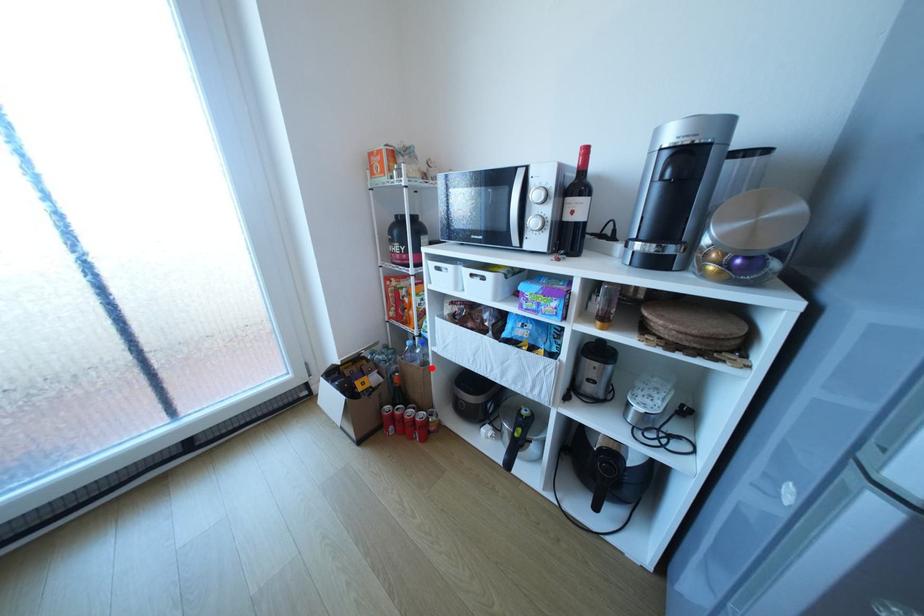
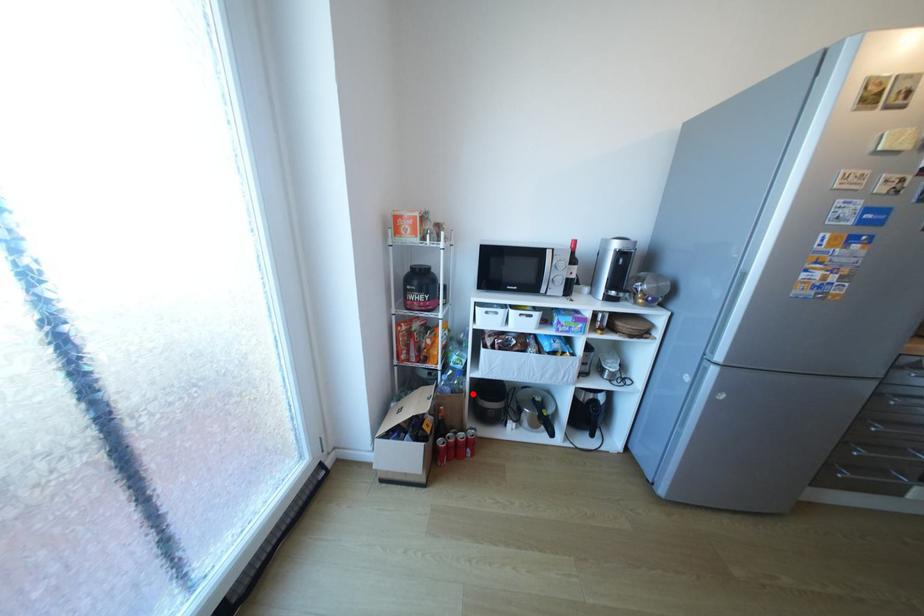
I am providing you with two images of the same scene from different viewpoints. A red point is marked on the first image and another point is marked on the second image. Is the red point in image1 aligned with the point shown in image2?

Yes